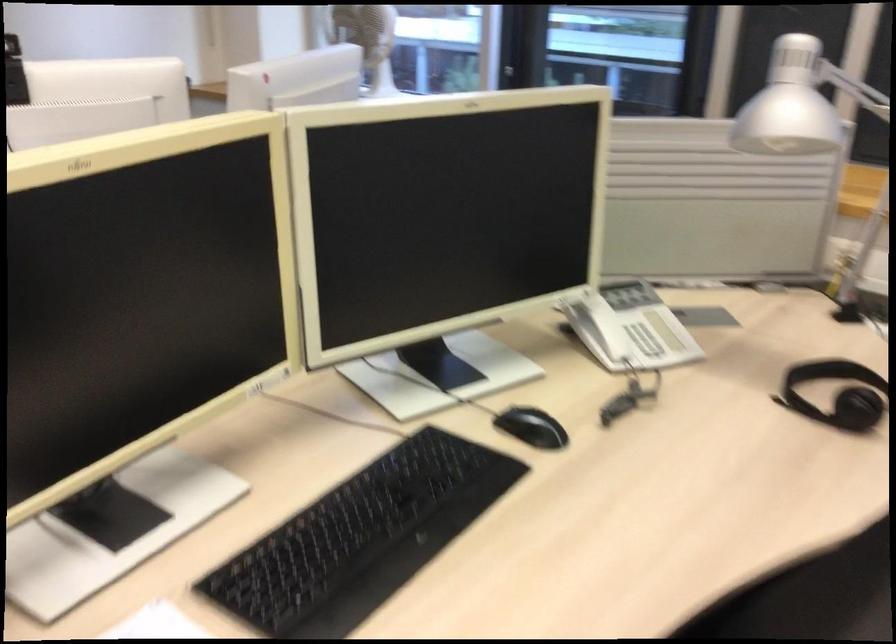
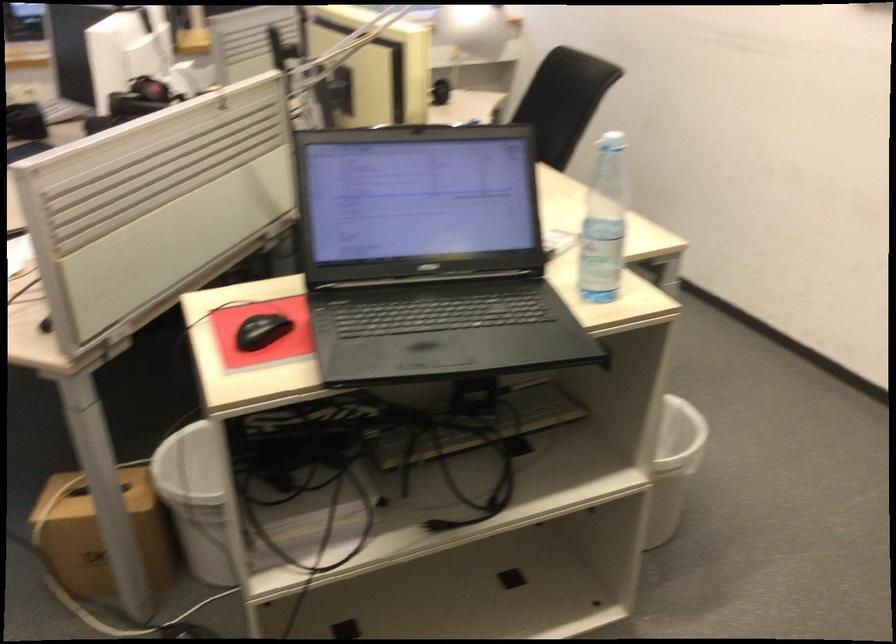
Question: I am providing you with two images of the same scene from different viewpoints. Which of the following objects are not visible in image2?

Choices:
 (A) black headphones
 (B) black computer mouse
 (C) brown cardboard box
 (D) shower temperature knob

Answer: (A)